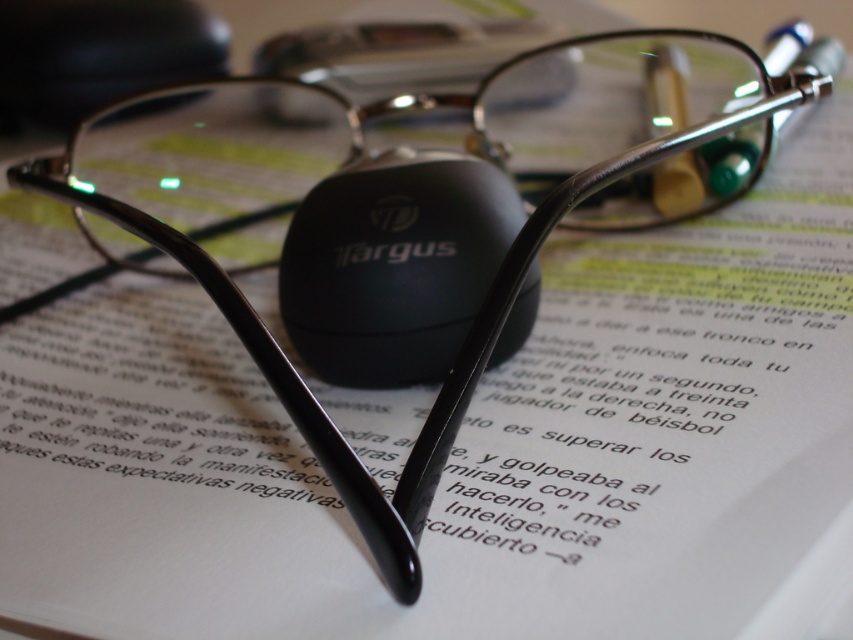
Consider the image. You are organizing your desk and notice two items on your desk. You have the matte black mouse at center and the black matte mouse at upper center. Which one is located more to the right?

The matte black mouse at center is positioned on the right side of black matte mouse at upper center, so the matte black mouse at center is more to the right.

You are a graphic designer working on a project and need to locate your matte black mouse at center. Based on the scene description, where would you find it?

The matte black mouse at center is located at the point with coordinates 0.414 in the x direction and 0.462 in the y direction.

You are organizing your desk and need to place a new item between the matte black mouse at center and the black matte mouse at upper center. Which mouse should you position the new item closer to based on their positions?

You should position the new item closer to the matte black mouse at center because it is closer to you than the black matte mouse at upper center.